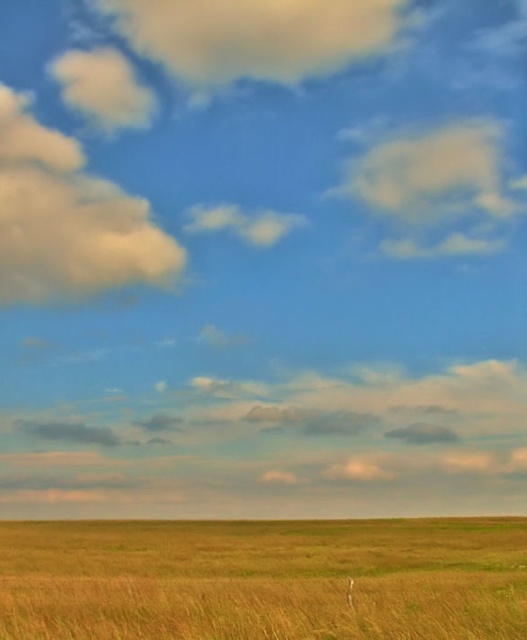
Between golden grassland at lower center and cloudy sky at upper left, which one has more height?

cloudy sky at upper left is taller.

Who is more distant from viewer, (469, 547) or (84, 262)?

Point (84, 262)

This screenshot has width=527, height=640. Find the location of `golden grassland at lower center`. golden grassland at lower center is located at coordinates (265, 579).

Can you confirm if golden grassland at lower center is taller than cloudy cotton cloud at upper right?

In fact, golden grassland at lower center may be shorter than cloudy cotton cloud at upper right.

Which is in front, point (290, 554) or point (510, 184)?

Point (290, 554) is in front.

Which is in front, point (204, 548) or point (483, 221)?

Point (204, 548)

Identify the location of golden grassland at lower center. Image resolution: width=527 pixels, height=640 pixels. (265, 579).

Does cloudy sky at upper left have a larger size compared to cloudy cotton cloud at upper right?

Indeed, cloudy sky at upper left has a larger size compared to cloudy cotton cloud at upper right.

Does cloudy sky at upper left lie in front of cloudy cotton cloud at upper right?

Yes, it is in front of cloudy cotton cloud at upper right.

This screenshot has width=527, height=640. I want to click on cloudy sky at upper left, so click(x=67, y=220).